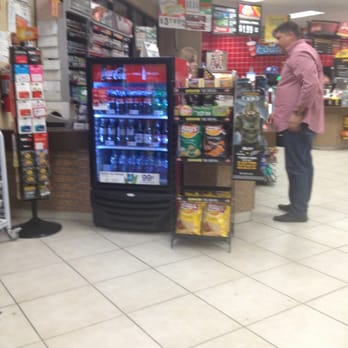
Locate an element on the screen. gift card rack is located at coordinates (31, 132), (22, 36), (41, 229).